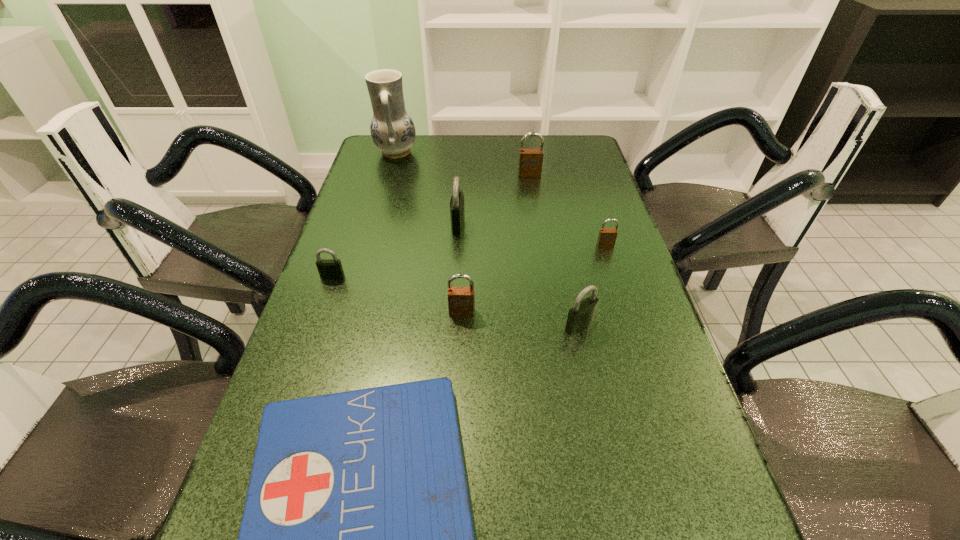
You are a GUI agent. You are given a task and a screenshot of the screen. Output one action in this format:
    pyautogui.click(x=<x>, y=<y>)
    Task: Click on the vacant space that is in between the farthest padlock and the farthest object
    The image size is (960, 540).
    Given the screenshot: What is the action you would take?
    pyautogui.click(x=463, y=164)

You are a GUI agent. You are given a task and a screenshot of the screen. Output one action in this format:
    pyautogui.click(x=<x>, y=<y>)
    Task: Click on the vacant area that lies between the nearest brown padlock and the blue pottery
    This screenshot has width=960, height=540.
    Given the screenshot: What is the action you would take?
    pyautogui.click(x=429, y=232)

Locate an element on the screen. empty space between the rightmost padlock and the farthest padlock is located at coordinates (567, 210).

Where is `free spot between the second smallest brown padlock and the seventh nearest object`? free spot between the second smallest brown padlock and the seventh nearest object is located at coordinates (495, 244).

The image size is (960, 540). Identify the location of empty space between the second nearest black padlock and the farthest black padlock. (x=396, y=250).

The image size is (960, 540). Identify the location of free space between the nearest brown padlock and the tallest object. (429, 232).

Choose which object is the seventh nearest neighbor to the nearest black padlock. Please provide its 2D coordinates. Your answer should be formatted as a tuple, i.e. [(x, y)], where the tuple contains the x and y coordinates of a point satisfying the conditions above.

[(393, 132)]

Select which object appears as the fifth closest to the second nearest black padlock. Please provide its 2D coordinates. Your answer should be formatted as a tuple, i.e. [(x, y)], where the tuple contains the x and y coordinates of a point satisfying the conditions above.

[(581, 315)]

Select which padlock appears as the second closest to the second farthest padlock. Please provide its 2D coordinates. Your answer should be formatted as a tuple, i.e. [(x, y)], where the tuple contains the x and y coordinates of a point satisfying the conditions above.

[(461, 300)]

You are a GUI agent. You are given a task and a screenshot of the screen. Output one action in this format:
    pyautogui.click(x=<x>, y=<y>)
    Task: Click on the padlock identified as the second closest to the pottery
    This screenshot has height=540, width=960.
    Given the screenshot: What is the action you would take?
    (x=530, y=160)